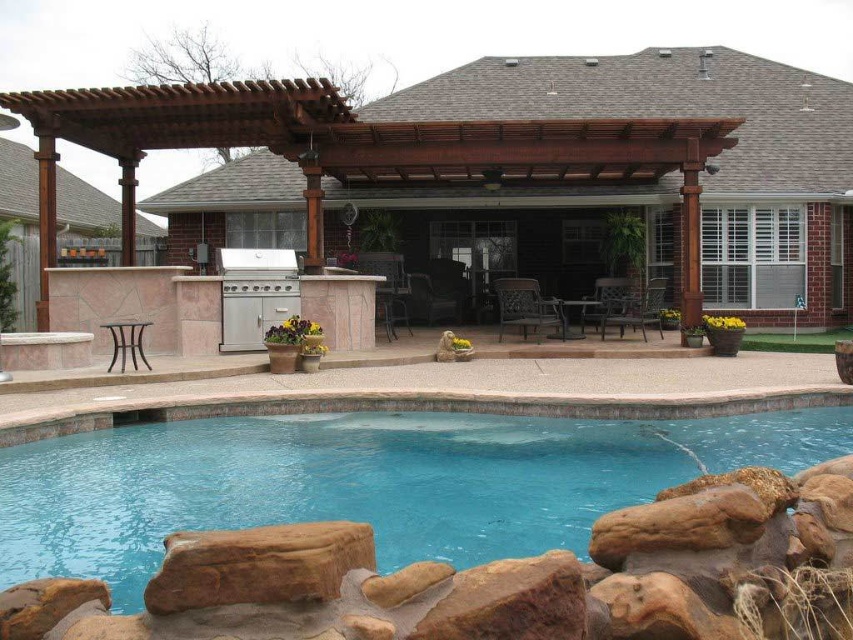
Question: Considering the relative positions of brown wood pergola at center and blue smooth water at center in the image provided, where is brown wood pergola at center located with respect to blue smooth water at center?

Choices:
 (A) left
 (B) right

Answer: (B)

Question: Can you confirm if brown wood pergola at center is positioned to the right of blue smooth water at center?

Choices:
 (A) no
 (B) yes

Answer: (B)

Question: Observing the image, what is the correct spatial positioning of brown wood pergola at center in reference to blue smooth water at center?

Choices:
 (A) below
 (B) above

Answer: (B)

Question: Which of the following is the farthest from the observer?

Choices:
 (A) brown wood pergola at center
 (B) blue smooth water at center

Answer: (A)